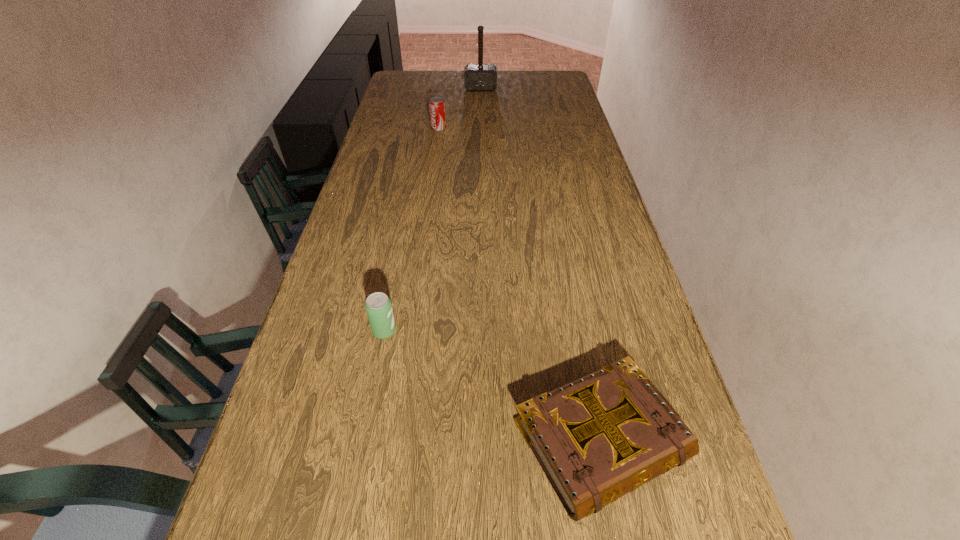
This screenshot has height=540, width=960. Find the location of `vacant area that lies between the nearest object and the third nearest object`. vacant area that lies between the nearest object and the third nearest object is located at coordinates (519, 284).

The image size is (960, 540). I want to click on free space that is in between the second farthest object and the hardback book, so click(519, 284).

Find the location of `vacant space in between the hammer and the farther soda`. vacant space in between the hammer and the farther soda is located at coordinates (460, 109).

The image size is (960, 540). What are the coordinates of `free space between the leftmost object and the nearest object` in the screenshot? It's located at (492, 385).

Identify the location of vacant space in between the farther soda and the hardback book. This screenshot has width=960, height=540. (519, 284).

Find the location of a particular element. vacant area that lies between the farther soda and the hammer is located at coordinates (460, 109).

I want to click on vacant space that's between the second nearest object and the third nearest object, so click(412, 230).

This screenshot has width=960, height=540. What are the coordinates of `vacant space in between the nearer soda and the farther soda` in the screenshot? It's located at (412, 230).

Image resolution: width=960 pixels, height=540 pixels. Find the location of `object that can be found as the closest to the right soda`. object that can be found as the closest to the right soda is located at coordinates (477, 77).

Select which object is the third closest to the farthest object. Please provide its 2D coordinates. Your answer should be formatted as a tuple, i.e. [(x, y)], where the tuple contains the x and y coordinates of a point satisfying the conditions above.

[(597, 438)]